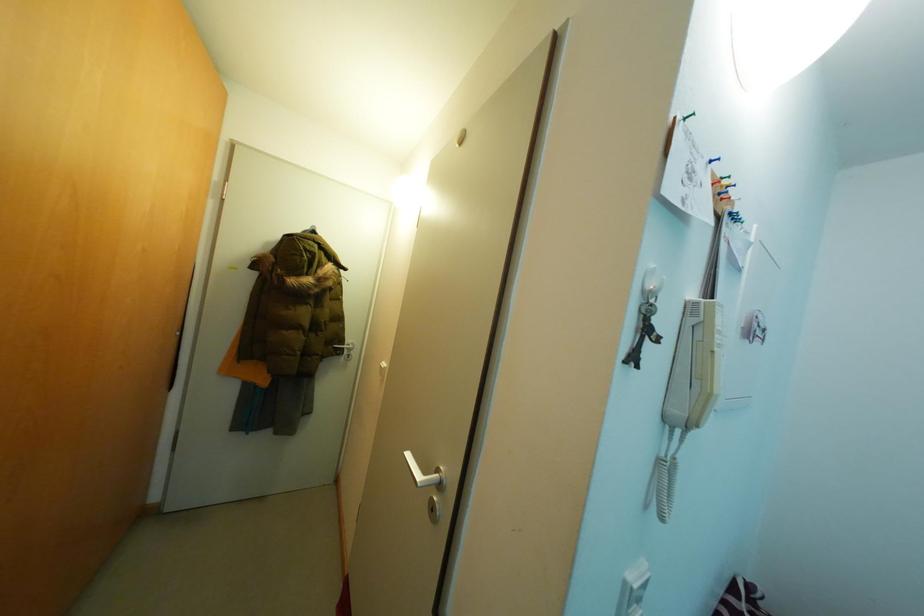
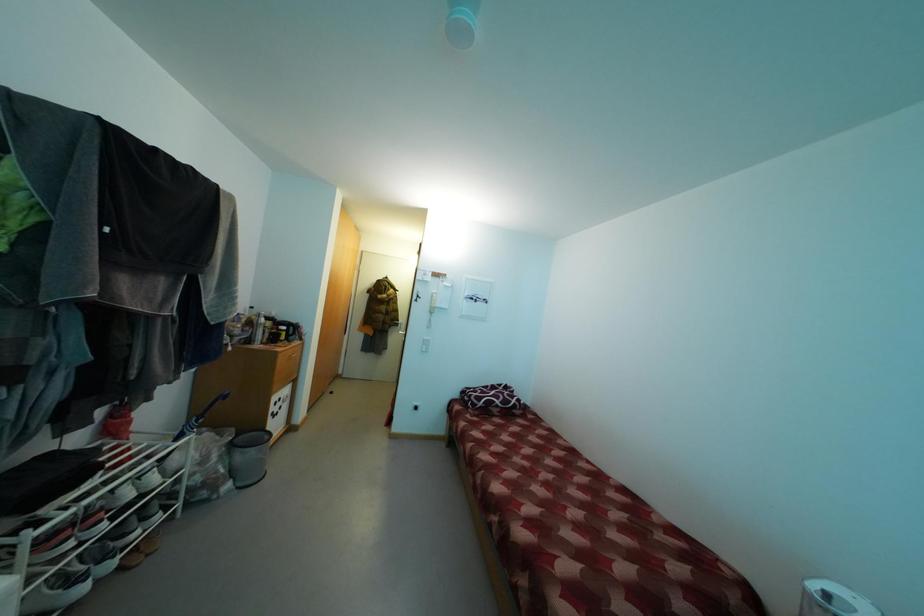
What movement of the cameraman would produce the second image?

The cameraman walked toward right, backward.